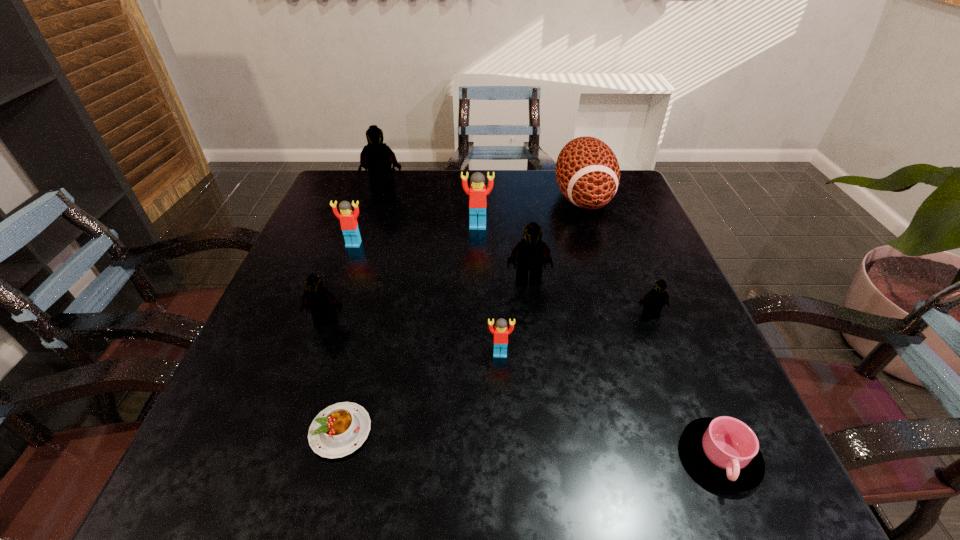
At what (x,y) coordinates should I click in order to perform the action: click on empty location between the third smallest black Lego and the rightmost black Lego. Please return your answer as a coordinate pair (x, y). The image size is (960, 540). Looking at the image, I should click on (589, 297).

Image resolution: width=960 pixels, height=540 pixels. What are the coordinates of `vacant space that is in between the pink cup and the biggest black Lego` in the screenshot? It's located at (551, 322).

Identify the location of vacant area that lies between the second smallest black Lego and the sixth nearest Lego. This screenshot has height=540, width=960. (402, 274).

At what (x,y) coordinates should I click in order to perform the action: click on free space that is in between the second nearest red Lego and the smallest black Lego. Please return your answer as a coordinate pair (x, y). The height and width of the screenshot is (540, 960). Looking at the image, I should click on (502, 279).

This screenshot has width=960, height=540. In order to click on vacant point located between the cup and the second smallest black Lego in this screenshot , I will do `click(522, 389)`.

Find the location of a particular element. free space between the farthest red Lego and the third farthest Lego is located at coordinates (416, 235).

The height and width of the screenshot is (540, 960). Identify the location of empty space between the rightmost Lego and the third black Lego from left to right. (589, 297).

In order to click on vacant region between the third biggest black Lego and the biggest black Lego in this screenshot , I will do [x=354, y=254].

At what (x,y) coordinates should I click in order to perform the action: click on free point between the tallest Lego and the third biggest black Lego. Please return your answer as a coordinate pair (x, y). The height and width of the screenshot is (540, 960). Looking at the image, I should click on (354, 254).

Locate an element on the screen. This screenshot has height=540, width=960. object that is the fifth nearest to the football is located at coordinates (376, 157).